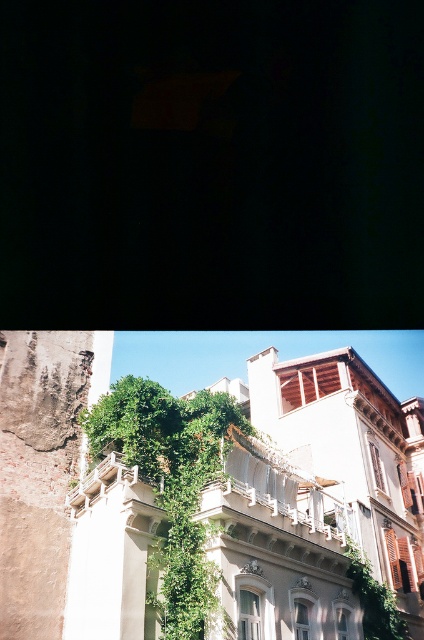
You are standing in front of the building and notice a point marked at coordinates (172, 483). What is the object located at this point?

The object located at point (172, 483) is green leafy ivy at center.

You are a window cleaner standing on the ground looking up at the building. You need to clean both the green leafy ivy at center and the white stone balcony at center. Which object will require you to climb higher to reach?

The green leafy ivy at center is taller than the white stone balcony at center, so you will need to climb higher to reach the green leafy ivy at center.

You are a painter planning to paint the building. You want to know if the green leafy ivy at center can fit entirely within the white stone balcony at center. Based on their sizes, can it?

The green leafy ivy at center has a width less than the white stone balcony at center, so it can fit entirely within the white stone balcony at center.